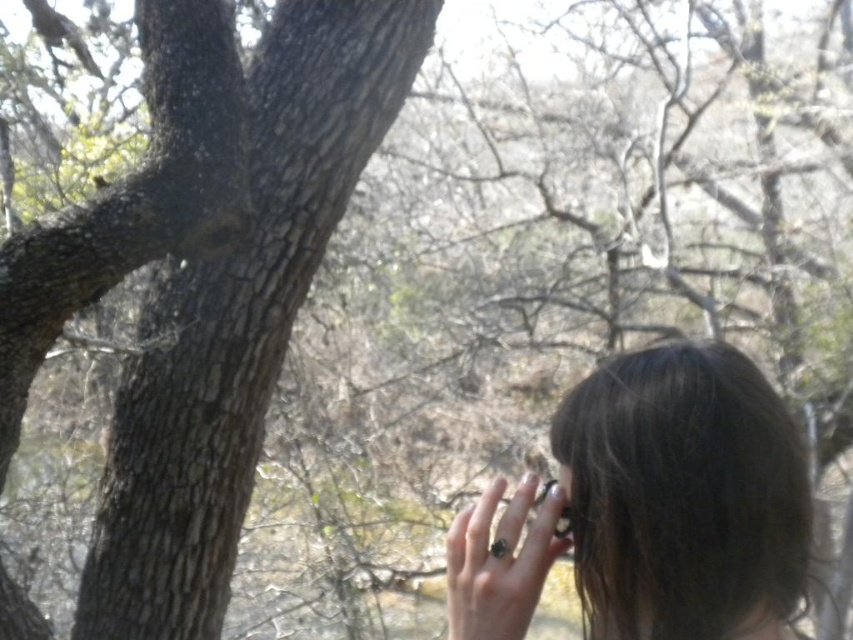
Question: Can you confirm if dark brown hair at center is wider than black glossy ring at lower right?

Choices:
 (A) no
 (B) yes

Answer: (B)

Question: Among these points, which one is nearest to the camera?

Choices:
 (A) (535, 531)
 (B) (560, 536)
 (C) (659, 522)

Answer: (C)

Question: Which of the following is the farthest from the observer?

Choices:
 (A) black polished ring at center
 (B) black glossy ring at lower right

Answer: (B)

Question: Which point appears farthest from the camera in this image?

Choices:
 (A) (555, 483)
 (B) (532, 560)

Answer: (A)

Question: Is dark brown hair at center to the left of black glossy ring at lower right from the viewer's perspective?

Choices:
 (A) yes
 (B) no

Answer: (B)

Question: Can you confirm if dark brown hair at center is positioned above black glossy ring at lower right?

Choices:
 (A) no
 (B) yes

Answer: (A)